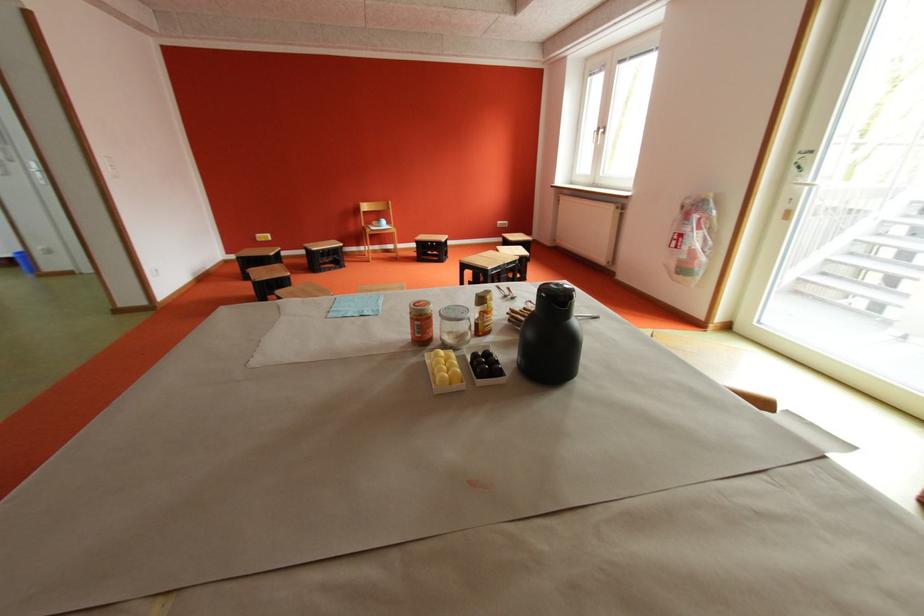
Where would you sit the chair sitting surface? Please return your answer as a coordinate pair (x, y).

(377, 224)